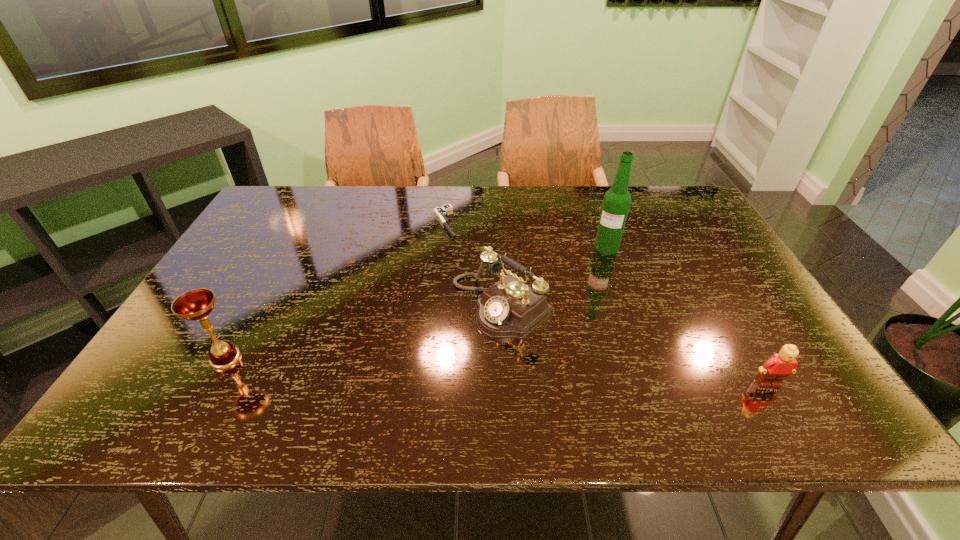
I want to click on free location located 0.130m on the label of the beer bottle, so click(x=597, y=282).

At what (x,y) coordinates should I click in order to perform the action: click on free space located 0.380m on the label of the beer bottle. Please return your answer as a coordinate pair (x, y). Image resolution: width=960 pixels, height=540 pixels. Looking at the image, I should click on (578, 349).

This screenshot has width=960, height=540. I want to click on vacant space positioned on the label of the beer bottle, so click(593, 296).

Find the location of a particular element. The image size is (960, 540). free space located 0.060m on the dial of the third farthest object is located at coordinates (447, 342).

What are the coordinates of `vacant area situated on the dial of the third farthest object` in the screenshot? It's located at (414, 367).

Identify the location of vacant area situated 0.060m on the dial of the third farthest object. This screenshot has width=960, height=540. (447, 342).

Find the location of a particular element. The width and height of the screenshot is (960, 540). vacant point located on the front-facing side of the pistol is located at coordinates (467, 262).

Image resolution: width=960 pixels, height=540 pixels. I want to click on free location located on the front-facing side of the pistol, so click(469, 266).

The image size is (960, 540). Identify the location of free space located on the front-facing side of the pistol. (485, 288).

I want to click on object situated at the far edge, so click(441, 212).